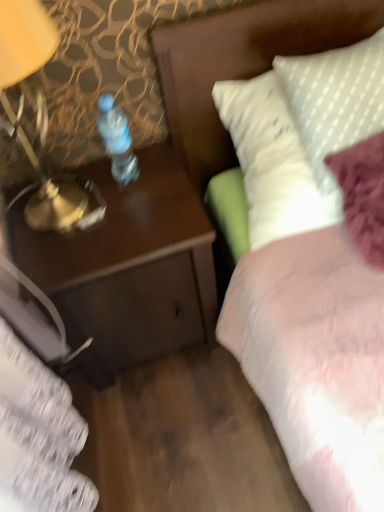
At what (x,y) coordinates should I click in order to perform the action: click on free area below gold metallic lamp at left (from a real-world perspective). Please return your answer as a coordinate pair (x, y). Image resolution: width=384 pixels, height=512 pixels. Looking at the image, I should click on (54, 211).